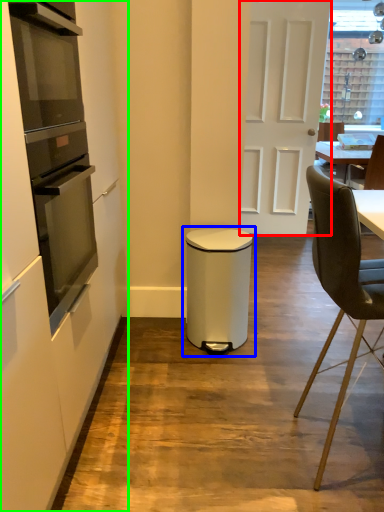
Question: Considering the real-world distances, which object is closest to door (highlighted by a red box)? waste container (highlighted by a blue box) or cabinetry (highlighted by a green box).

Choices:
 (A) waste container
 (B) cabinetry

Answer: (A)